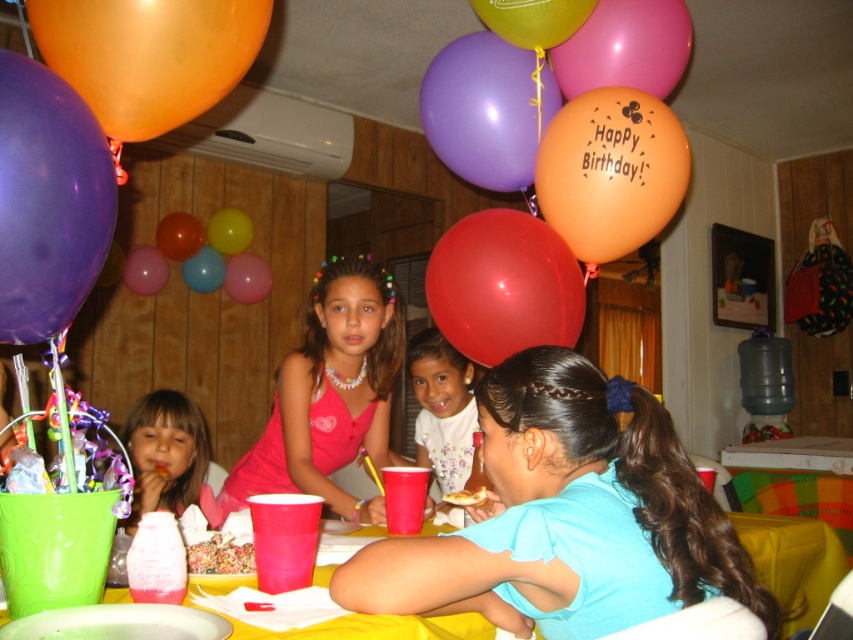
Question: Considering the relative positions of purple rubber balloon at upper left and matte pink dress at lower left in the image provided, where is purple rubber balloon at upper left located with respect to matte pink dress at lower left?

Choices:
 (A) below
 (B) above

Answer: (B)

Question: Which object is farther from the camera taking this photo?

Choices:
 (A) glossy red balloon at center
 (B) white floral dress at center
 (C) orange matte balloon at upper center

Answer: (B)

Question: Which point appears closest to the camera in this image?

Choices:
 (A) [502, 324]
 (B) [154, 104]
 (C) [654, 76]
 (D) [463, 384]

Answer: (B)

Question: Which point is closer to the camera taking this photo?

Choices:
 (A) (347, 380)
 (B) (187, 468)
 (C) (625, 152)

Answer: (C)

Question: Can you confirm if glossy red balloon at center is bigger than yellow matte balloon at upper center?

Choices:
 (A) yes
 (B) no

Answer: (A)

Question: Is pink satin dress at center closer to the viewer compared to orange matte balloon at upper right?

Choices:
 (A) no
 (B) yes

Answer: (B)